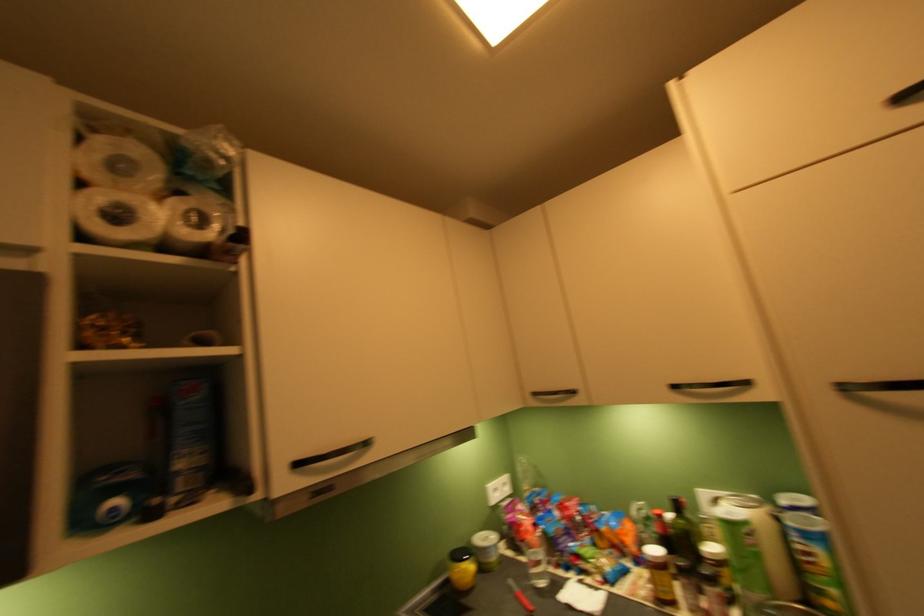
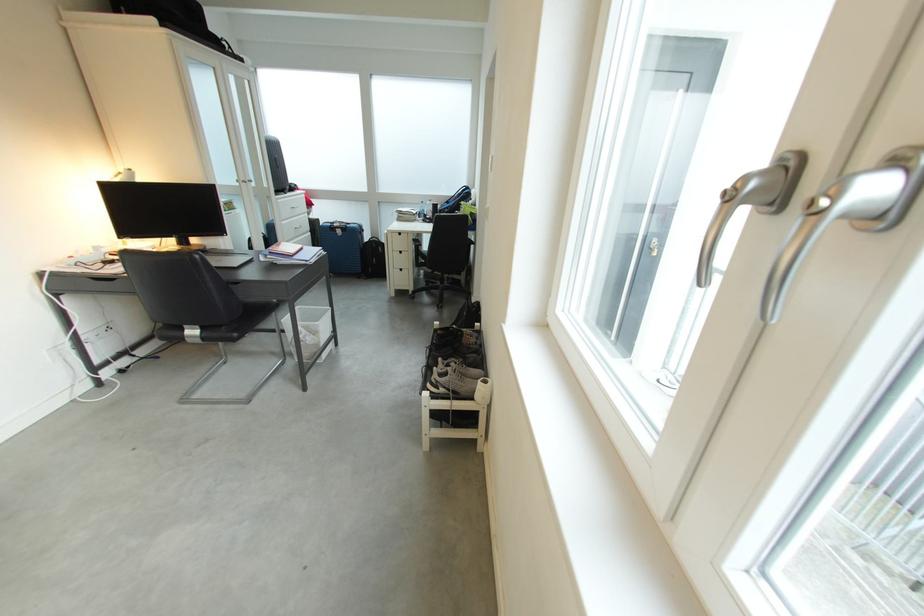
Question: I am providing you with two images of the same scene from different viewpoints. Which of the following objects are not visible in image2?

Choices:
 (A) silver cabinet knob
 (B) black laptop computer
 (C) foosball rod handle
 (D) white paper roll

Answer: (D)